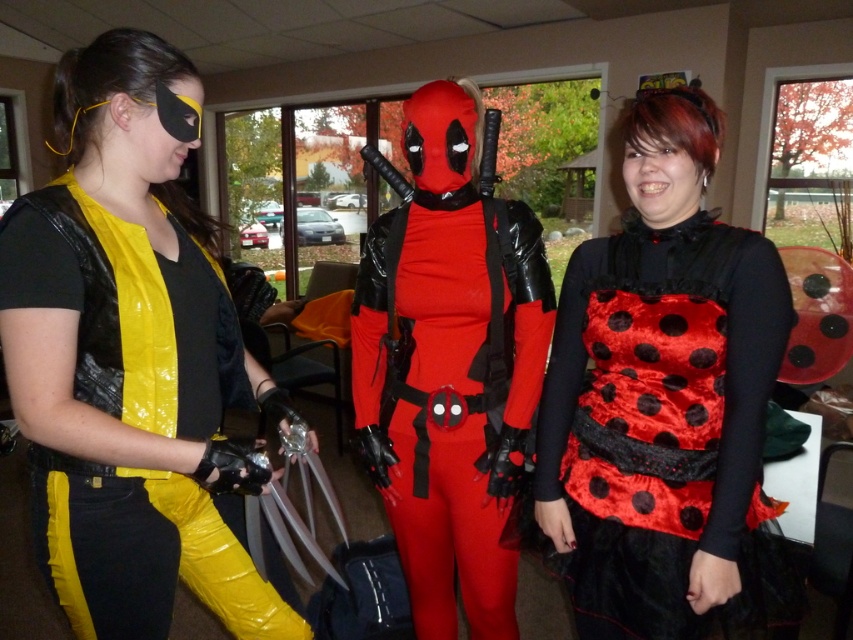
Which is behind, point (737, 403) or point (433, 353)?

The point (433, 353) is behind.

Who is more distant from viewer, [612,433] or [438,317]?

The point [438,317] is more distant.

Locate an element on the screen. The image size is (853, 640). velvet polka dot dress at center is located at coordinates (665, 401).

Does shiny yellow vest at left have a larger size compared to rubberized red bodysuit at center?

Actually, shiny yellow vest at left might be smaller than rubberized red bodysuit at center.

Is point (38, 451) farther from viewer compared to point (425, 412)?

That is False.

Which is in front, point (97, 612) or point (403, 312)?

Point (97, 612) is more forward.

The width and height of the screenshot is (853, 640). In order to click on shiny yellow vest at left in this screenshot , I will do pos(131,358).

Does shiny yellow vest at left lie behind velvet polka dot dress at center?

No.

Is shiny yellow vest at left to the right of velvet polka dot dress at center from the viewer's perspective?

Incorrect, shiny yellow vest at left is not on the right side of velvet polka dot dress at center.

Describe the element at coordinates (131, 358) in the screenshot. The image size is (853, 640). I see `shiny yellow vest at left` at that location.

Where is `shiny yellow vest at left`? Image resolution: width=853 pixels, height=640 pixels. shiny yellow vest at left is located at coordinates (131, 358).